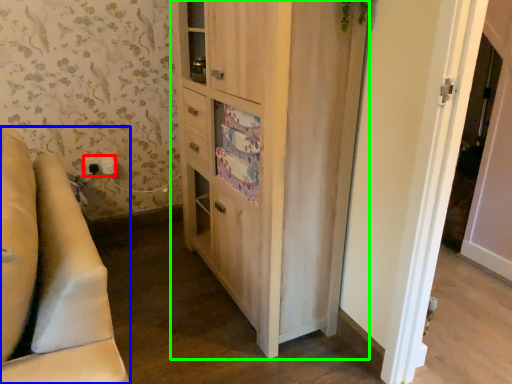
Question: Which is nearer to the electric outlet (highlighted by a red box)? furniture (highlighted by a blue box) or cabinetry (highlighted by a green box).

Choices:
 (A) furniture
 (B) cabinetry

Answer: (B)